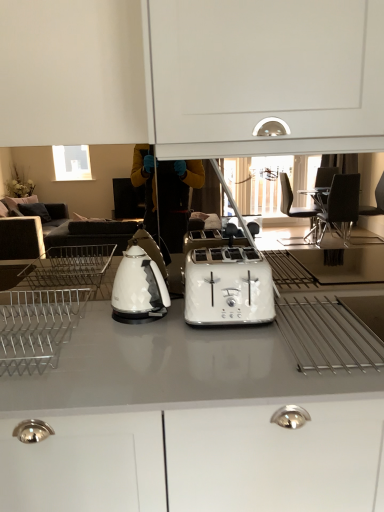
Question: Is white glossy toaster at center situated inside white glossy countertop at center or outside?

Choices:
 (A) outside
 (B) inside

Answer: (A)

Question: From a real-world perspective, is white glossy toaster at center physically located above or below white glossy countertop at center?

Choices:
 (A) above
 (B) below

Answer: (A)

Question: Which object is the farthest from the white glossy countertop at center?

Choices:
 (A) white glossy electric kettle at left
 (B) white glossy toaster at center
 (C) metallic silver dish rack at left

Answer: (A)

Question: Based on their relative distances, which object is farther from the white glossy toaster at center?

Choices:
 (A) metallic silver dish rack at left
 (B) white glossy countertop at center
 (C) white glossy electric kettle at left

Answer: (A)